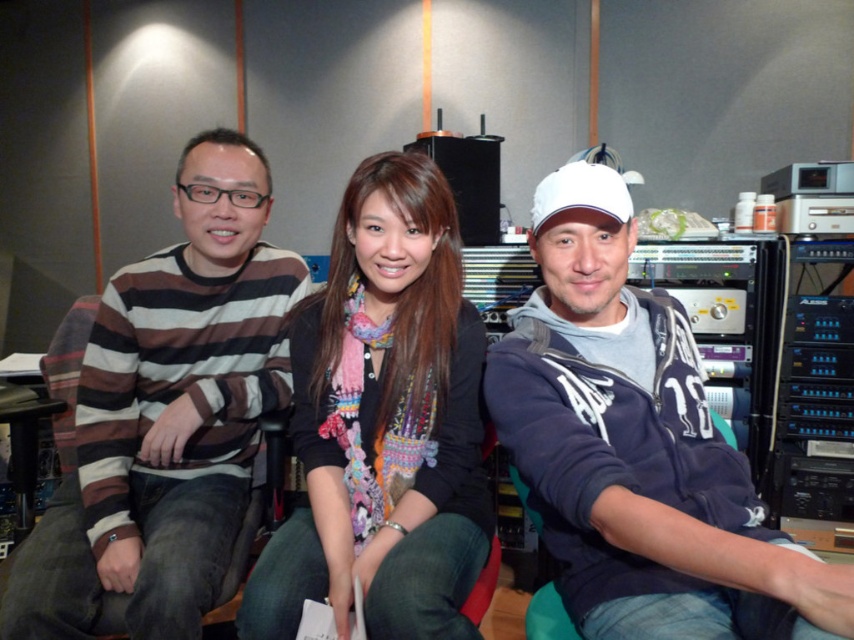
You are a photographer standing in the studio and want to place a 30 cm wide decorative item between the person on the left and the white matte baseball cap at upper right. Is there enough space?

The distance between the person on the left and the white matte baseball cap at upper right is not provided, but the distance from the viewer to the cap is 63.52 centimeters. Without knowing the exact spacing between them, it is impossible to determine if there is enough space for the 30 cm wide decorative item.

You are standing in the studio and want to place a new microphone stand at the point where the white matte baseball cap at upper right is located. Is this feasible? Please explain.

The white matte baseball cap at upper right is located at coordinates point (636,448). Since the cap is already at that position, placing the microphone stand there would require removing the cap first.

Based on the coordinates provided, which object is located at point (167, 417) in the scene?

The point (167, 417) corresponds to the striped cotton sweater at left.